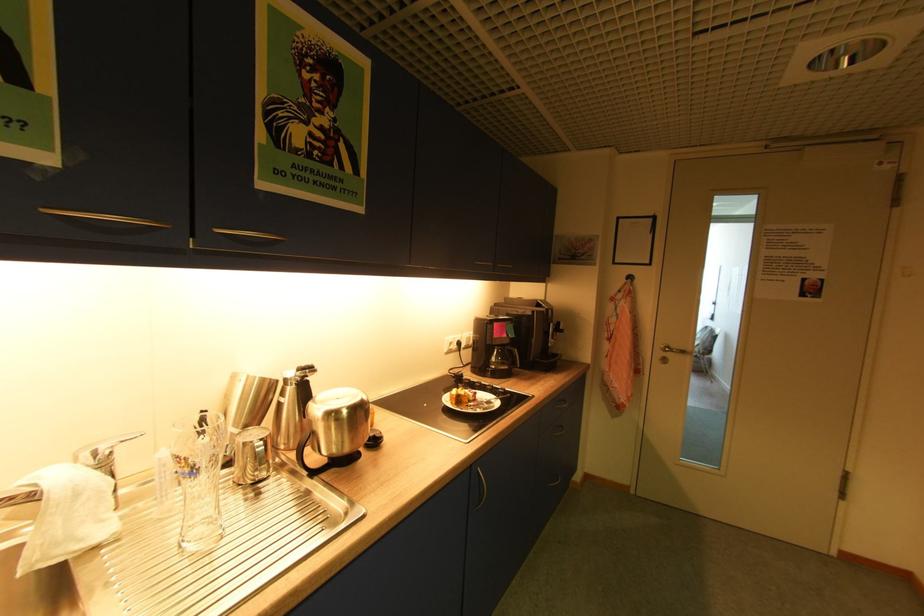
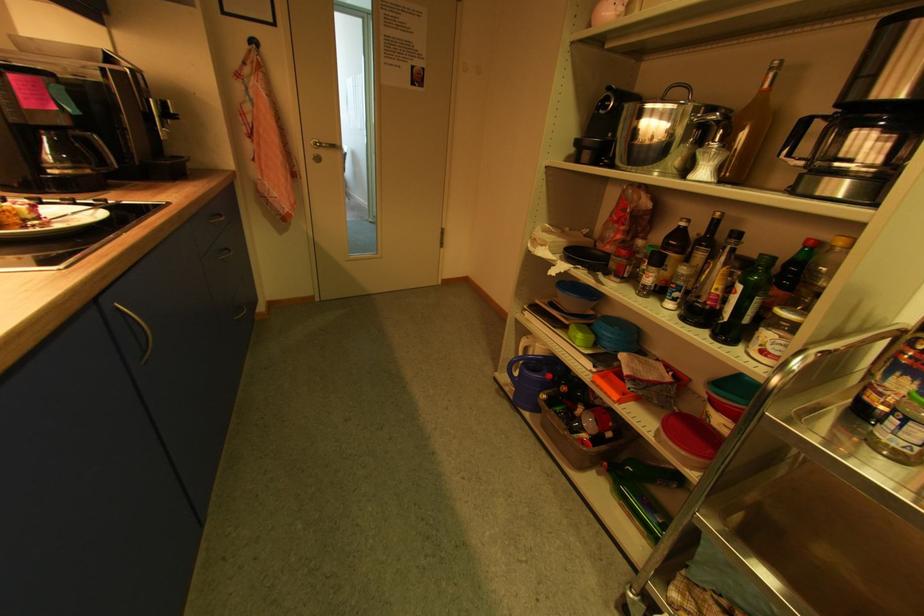
Locate, in the second image, the point that corresponds to the point at 484,474 in the first image.

(125, 310)